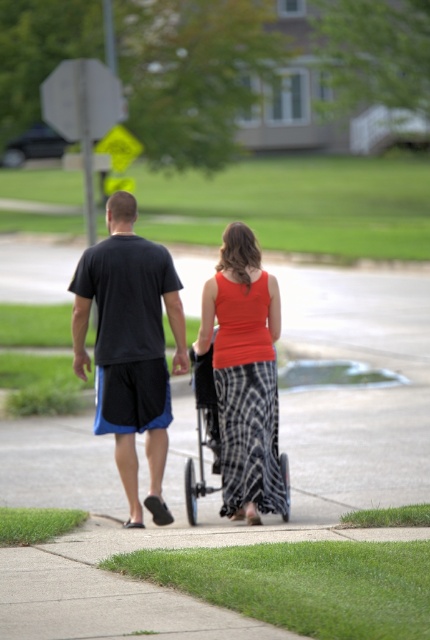
You are a pedestrian standing at the point marked as point (x=129, y=346) in the image. What object is located exactly at your current position?

The black fabric shorts at center are located exactly at point (x=129, y=346).

You are standing in the suburban scene and want to place a small flower pot between the two points, point [123,481] and point [245,380]. Which point should the flower pot be closer to in order to be placed closer to the camera?

The flower pot should be closer to point [123,481] because it is further to the camera than point [245,380], so placing it near that point keeps it closer to the viewer.

You are a pedestrian looking to cross the street safely. You see the black fabric shorts at center and the orange sleeveless top at center in your path. Which of these two objects is closer to you?

The orange sleeveless top at center is behind the black fabric shorts at center, so the black fabric shorts at center is closer to you.